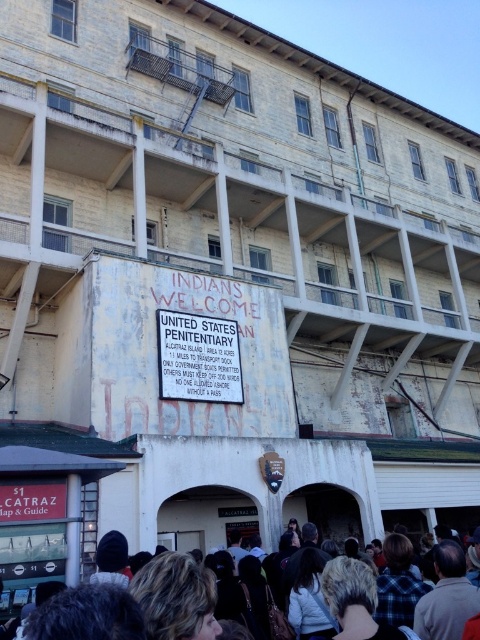
Who is positioned more to the left, dark hair at lower center or white paper sign at center?

white paper sign at center is more to the left.

Based on the photo, between dark hair at lower center and white paper sign at center, which one has more height?

Standing taller between the two is dark hair at lower center.

Locate an element on the screen. This screenshot has width=480, height=640. dark hair at lower center is located at coordinates (423, 593).